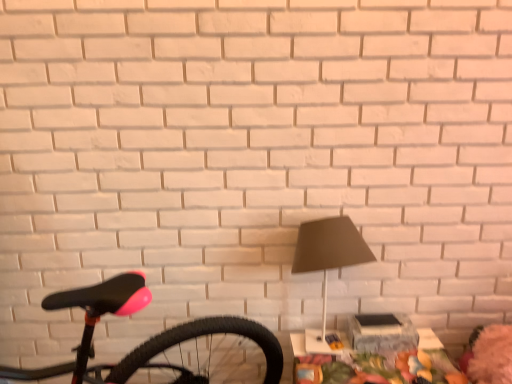
This screenshot has height=384, width=512. Find the location of `matte black lamp at center`. matte black lamp at center is located at coordinates (329, 250).

The image size is (512, 384). What do you see at coordinates (329, 250) in the screenshot? I see `matte black lamp at center` at bounding box center [329, 250].

Measure the distance between point (307, 267) and camera.

Point (307, 267) is 1.35 meters from camera.

You are a GUI agent. You are given a task and a screenshot of the screen. Output one action in this format:
    pyautogui.click(x=<x>, y=<y>)
    Task: Click on the white glossy table at lower right
    
    Given the screenshot: What is the action you would take?
    pyautogui.click(x=377, y=364)

What is the approximate width of white glossy table at lower right?

white glossy table at lower right is 11.88 inches in width.

Describe the element at coordinates (377, 364) in the screenshot. The width and height of the screenshot is (512, 384). I see `white glossy table at lower right` at that location.

Locate an element on the screen. The image size is (512, 384). matte black lamp at center is located at coordinates (329, 250).

Considering the positions of objects white glossy table at lower right and matte black lamp at center in the image provided, who is more to the right, white glossy table at lower right or matte black lamp at center?

white glossy table at lower right.

Which object is more forward, white glossy table at lower right or matte black lamp at center?

matte black lamp at center is in front.

Is point (313, 367) farther from camera compared to point (312, 267)?

Yes, it is.

From the image's perspective, which is above, white glossy table at lower right or matte black lamp at center?

matte black lamp at center.

From a real-world perspective, between white glossy table at lower right and matte black lamp at center, who is vertically higher?

matte black lamp at center, from a real-world perspective.

Which of these two, white glossy table at lower right or matte black lamp at center, is thinner?

matte black lamp at center is thinner.

Does white glossy table at lower right have a lesser height compared to matte black lamp at center?

Correct, white glossy table at lower right is not as tall as matte black lamp at center.

Is white glossy table at lower right bigger or smaller than matte black lamp at center?

Clearly, white glossy table at lower right is larger in size than matte black lamp at center.

Consider the image. Is matte black lamp at center a part of white glossy table at lower right?

No.

Are white glossy table at lower right and matte black lamp at center beside each other?

No, white glossy table at lower right is not touching matte black lamp at center.

In the scene shown: Is white glossy table at lower right oriented away from matte black lamp at center?

No, white glossy table at lower right is not facing the opposite direction of matte black lamp at center.

What's the angular difference between white glossy table at lower right and matte black lamp at center's facing directions?

white glossy table at lower right and matte black lamp at center are facing 0.51 degrees away from each other.

Locate an element on the screen. This screenshot has height=384, width=512. table behind the matte black lamp at center is located at coordinates (377, 364).

Consider the image. Can you confirm if matte black lamp at center is positioned to the right of white glossy table at lower right?

Incorrect, matte black lamp at center is not on the right side of white glossy table at lower right.

Does matte black lamp at center lie behind white glossy table at lower right?

No, it is not.

Considering the positions of point (345, 265) and point (423, 329), is point (345, 265) closer or farther from the camera than point (423, 329)?

Point (345, 265) is closer to the camera than point (423, 329).

From the image's perspective, between matte black lamp at center and white glossy table at lower right, who is located below?

From the image's view, white glossy table at lower right is below.

Looking at this image, from a real-world perspective, which object rests below the other?

white glossy table at lower right.

Considering the sizes of matte black lamp at center and white glossy table at lower right in the image, is matte black lamp at center wider or thinner than white glossy table at lower right?

Clearly, matte black lamp at center has less width compared to white glossy table at lower right.

In terms of height, does matte black lamp at center look taller or shorter compared to white glossy table at lower right?

Considering their sizes, matte black lamp at center has more height than white glossy table at lower right.

Based on the photo, between matte black lamp at center and white glossy table at lower right, which one has larger size?

white glossy table at lower right is bigger.

Can we say matte black lamp at center lies outside white glossy table at lower right?

Yes, matte black lamp at center is outside of white glossy table at lower right.

Is matte black lamp at center beside white glossy table at lower right?

No, matte black lamp at center is not touching white glossy table at lower right.

Is matte black lamp at center turned away from white glossy table at lower right?

No, white glossy table at lower right is not at the back of matte black lamp at center.

Can you tell me how much matte black lamp at center and white glossy table at lower right differ in facing direction?

There is a 0.51-degree angle between the facing directions of matte black lamp at center and white glossy table at lower right.

How far apart are matte black lamp at center and white glossy table at lower right?

matte black lamp at center and white glossy table at lower right are 16.34 inches apart.

In order to click on lamp lying above the white glossy table at lower right (from the image's perspective) in this screenshot , I will do `click(329, 250)`.

Find the location of a particular element. This screenshot has height=384, width=512. table that is on the right side of matte black lamp at center is located at coordinates (377, 364).

Locate an element on the screen. This screenshot has height=384, width=512. lamp in front of the white glossy table at lower right is located at coordinates (329, 250).